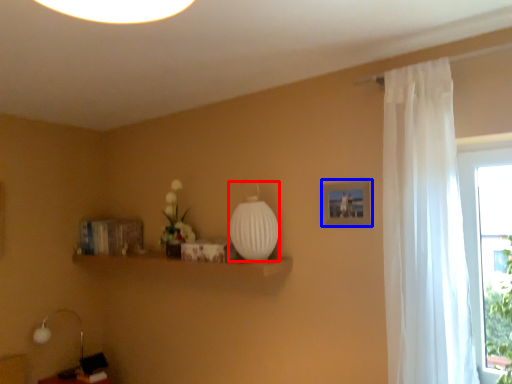
Question: Which point is further to the camera, glass vase (highlighted by a red box) or picture frame (highlighted by a blue box)?

Choices:
 (A) glass vase
 (B) picture frame

Answer: (A)